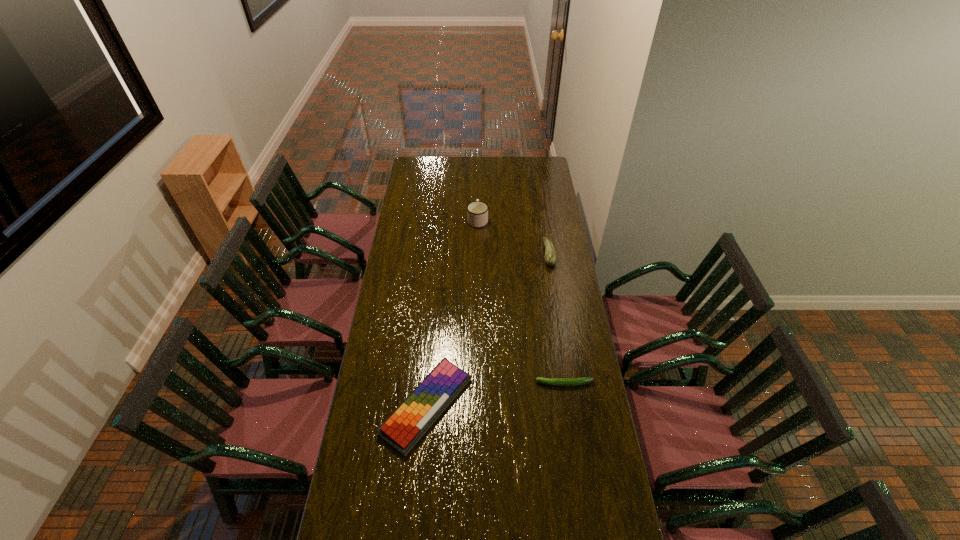
Where is `vacant area that lies between the mug and the computer keyboard`? The width and height of the screenshot is (960, 540). vacant area that lies between the mug and the computer keyboard is located at coordinates (452, 313).

Locate which object ranks second in proximity to the third nearest object. Please provide its 2D coordinates. Your answer should be formatted as a tuple, i.e. [(x, y)], where the tuple contains the x and y coordinates of a point satisfying the conditions above.

[(583, 380)]

Locate which object ranks third in proximity to the computer keyboard. Please provide its 2D coordinates. Your answer should be formatted as a tuple, i.e. [(x, y)], where the tuple contains the x and y coordinates of a point satisfying the conditions above.

[(477, 212)]